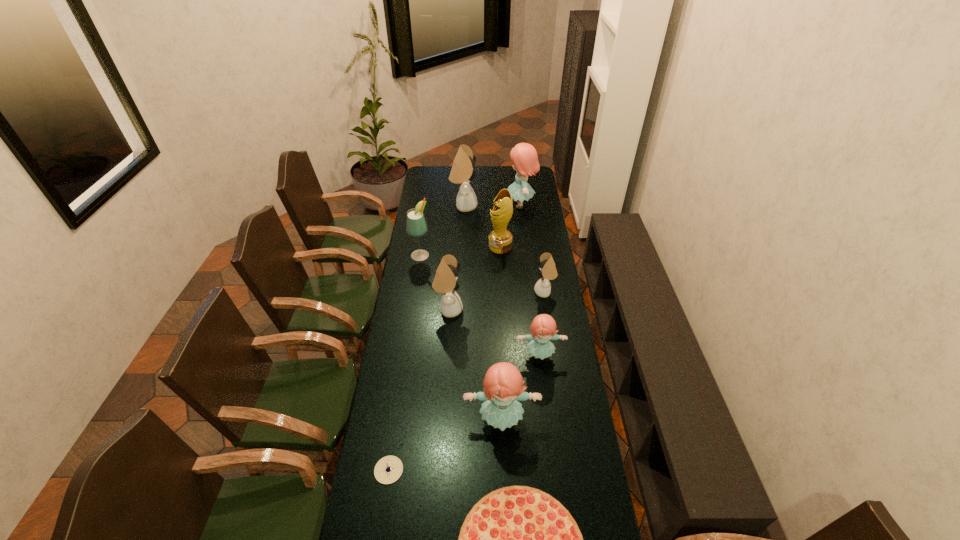
I want to click on the ninth tallest object, so click(x=388, y=469).

What are the coordinates of `the second nearest object` in the screenshot? It's located at (388, 469).

Locate an element on the screen. The image size is (960, 540). vacant region located 0.340m at the front face of the biggest black doll is located at coordinates (537, 206).

You are a GUI agent. You are given a task and a screenshot of the screen. Output one action in this format:
    pyautogui.click(x=<x>, y=<y>)
    Task: Click on the vacant area located 0.220m on the front-facing side of the farthest blue doll
    This screenshot has height=540, width=960.
    Given the screenshot: What is the action you would take?
    pyautogui.click(x=467, y=205)

The width and height of the screenshot is (960, 540). I want to click on free space located 0.170m on the front-facing side of the farthest blue doll, so click(475, 205).

Where is `vacant space situated on the front-facing side of the farthest blue doll`? vacant space situated on the front-facing side of the farthest blue doll is located at coordinates (476, 205).

I want to click on vacant area situated 0.070m on the back of the alcohol, so (x=423, y=239).

Where is `vacant space located 0.190m on the front-facing side of the gold award`? vacant space located 0.190m on the front-facing side of the gold award is located at coordinates (452, 246).

Where is `vacant space situated 0.320m on the front-facing side of the gold award`? vacant space situated 0.320m on the front-facing side of the gold award is located at coordinates (426, 246).

Identify the location of free space located 0.220m on the front-facing side of the gold award. (445, 246).